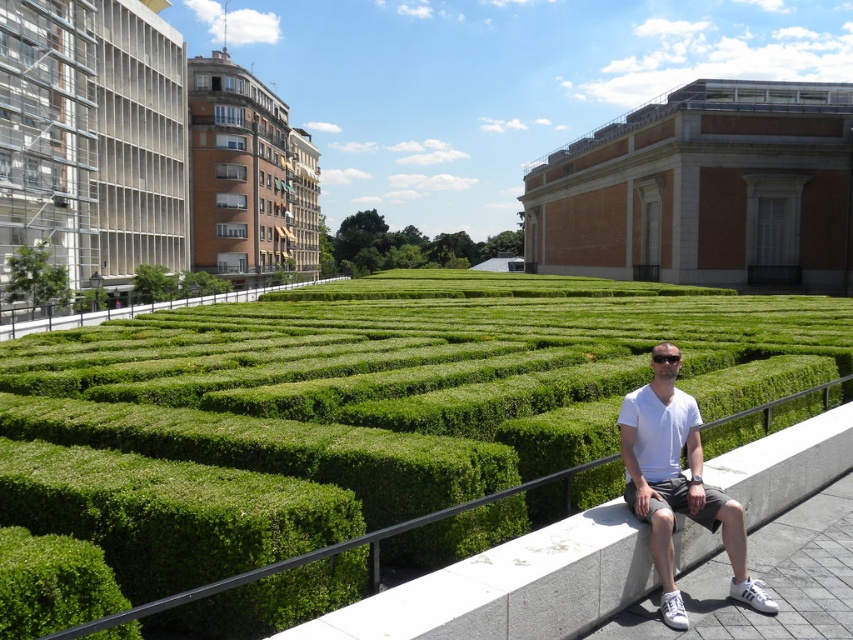
Does point (404, 285) come closer to viewer compared to point (627, 400)?

No, (404, 285) is behind (627, 400).

The width and height of the screenshot is (853, 640). What do you see at coordinates (369, 422) in the screenshot?
I see `green hedge maze at center` at bounding box center [369, 422].

Where is `green hedge maze at center`? green hedge maze at center is located at coordinates (369, 422).

Which is behind, point (340, 368) or point (67, 544)?

Positioned behind is point (340, 368).

Based on the photo, is green hedge maze at center in front of green leafy bush at lower left?

Yes, green hedge maze at center is in front of green leafy bush at lower left.

The width and height of the screenshot is (853, 640). Identify the location of green hedge maze at center. (369, 422).

Who is more distant from viewer, (697, 467) or (125, 625)?

Positioned behind is point (697, 467).

Measure the distance between white cotton shirt at right and green leafy bush at lower left.

A distance of 17.14 feet exists between white cotton shirt at right and green leafy bush at lower left.

Locate an element on the screen. This screenshot has height=640, width=853. white cotton shirt at right is located at coordinates (677, 483).

Find the location of a particular element. The image size is (853, 640). white cotton shirt at right is located at coordinates (677, 483).